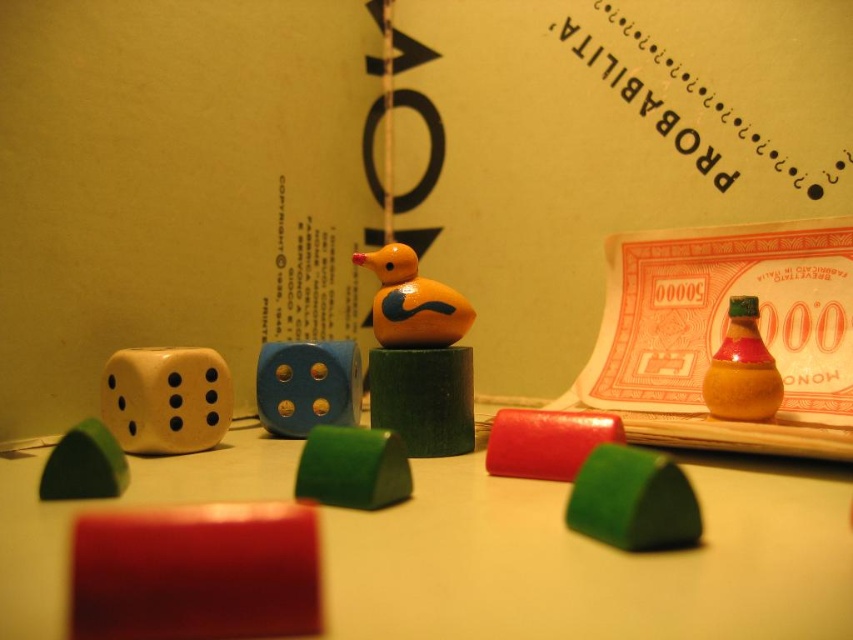
You are organizing a tabletop game and need to place the matte orange bottle at center right and the green matte triangle at lower left into a storage box. The box has a height limit of 10 cm. Can you determine if both items will fit vertically without exceeding the height limit?

The matte orange bottle at center right has a larger size compared to green matte triangle at lower left. However, the exact heights of both items are not provided in the description. Therefore, it is uncertain if they will fit within the 10 cm height limit without additional information.

You are a small toy car that is 10 inches long. You want to drive from the edge of the table to the wooden blocks at center. Is there enough space for you to reach them without falling off the table?

The wooden blocks at center are 18.79 inches away from the viewer. Since the toy car is only 10 inches long, there is sufficient space for it to reach the wooden blocks at center without falling off the table.

You are organizing a game setup on the table and need to place a new item exactly where the wooden blocks at center are currently positioned. According to the coordinates provided, where should you position the new item?

The wooden blocks at center are located at point (593, 561), so you should position the new item at those coordinates.